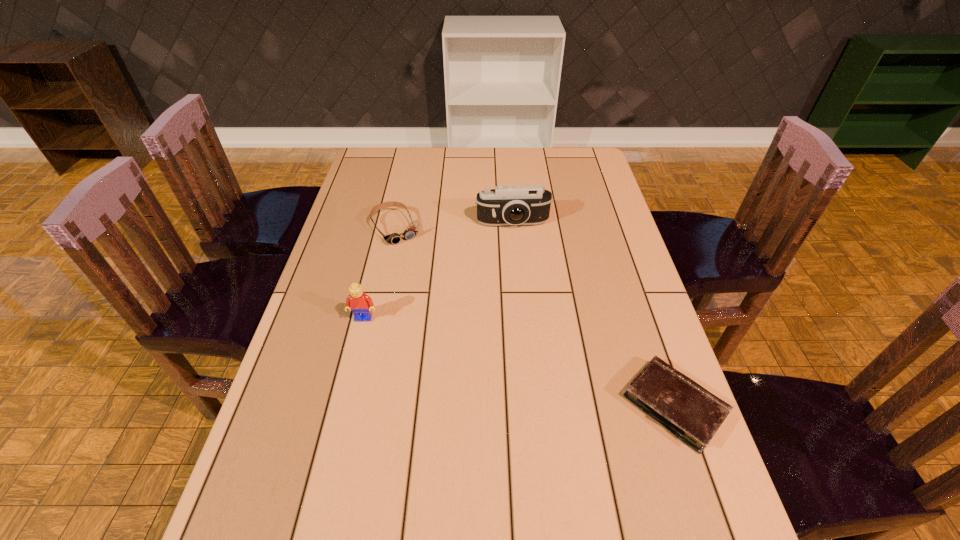
The image size is (960, 540). I want to click on vacant space at the far right corner of the desktop, so (x=583, y=173).

This screenshot has height=540, width=960. I want to click on empty location between the second tallest object and the camera, so click(439, 271).

Find the location of a particular element. vacant area between the diary and the third tallest object is located at coordinates (536, 317).

You are a GUI agent. You are given a task and a screenshot of the screen. Output one action in this format:
    pyautogui.click(x=<x>, y=<y>)
    Task: Click on the vacant point located between the rightmost object and the goggles
    
    Given the screenshot: What is the action you would take?
    pyautogui.click(x=536, y=317)

The image size is (960, 540). What are the coordinates of `free spot between the second nearest object and the shortest object` in the screenshot? It's located at (519, 362).

Where is `vacant area between the Lego and the camera`? The width and height of the screenshot is (960, 540). vacant area between the Lego and the camera is located at coordinates (439, 271).

Identify the location of unoccupied area between the third object from left to right and the goggles. This screenshot has height=540, width=960. (455, 226).

The image size is (960, 540). What are the coordinates of `vacant space that is in between the second nearest object and the third object from left to right` in the screenshot? It's located at (439, 271).

Find the location of a particular element. free space between the Lego and the rightmost object is located at coordinates (519, 362).

At what (x,y) coordinates should I click in order to perform the action: click on empty space between the second shortest object and the second object from right to left. Please return your answer as a coordinate pair (x, y). The image size is (960, 540). Looking at the image, I should click on (455, 226).